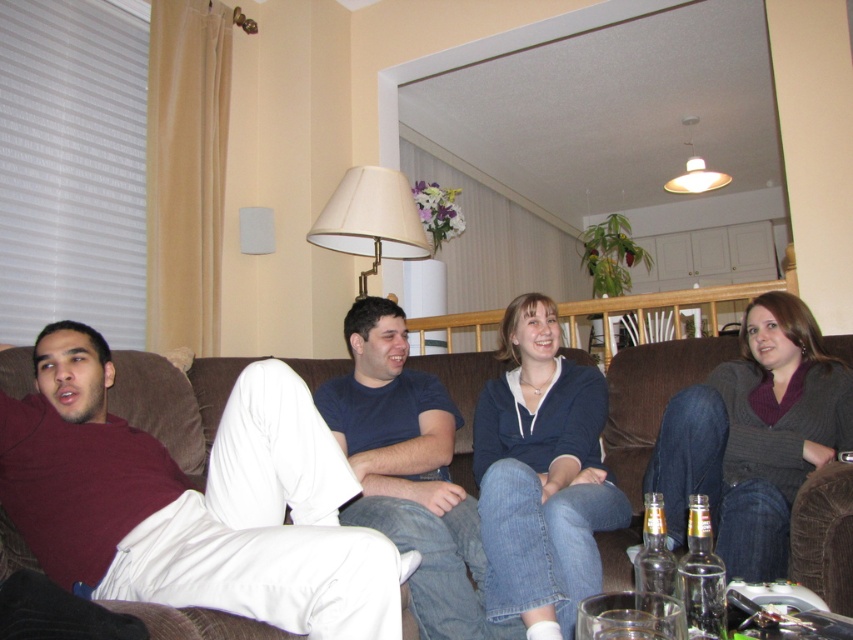
You are sitting on the brown couch and want to hand a book to the person wearing the maroon cotton shirt at left. Since the white matte lampshade at upper center is in the way, which direction should you move to avoid it?

Move to the left side of the white matte lampshade at upper center because the maroon cotton shirt at left is located to the left of it.

You are a guest at the gathering and want to place a small gift on the clear glass bottle at lower right. From your current position on the brown fabric couch at center, which direction should you move to reach the bottle?

The brown fabric couch at center is to the left of the clear glass bottle at lower right, so you should move to your right to reach the bottle.